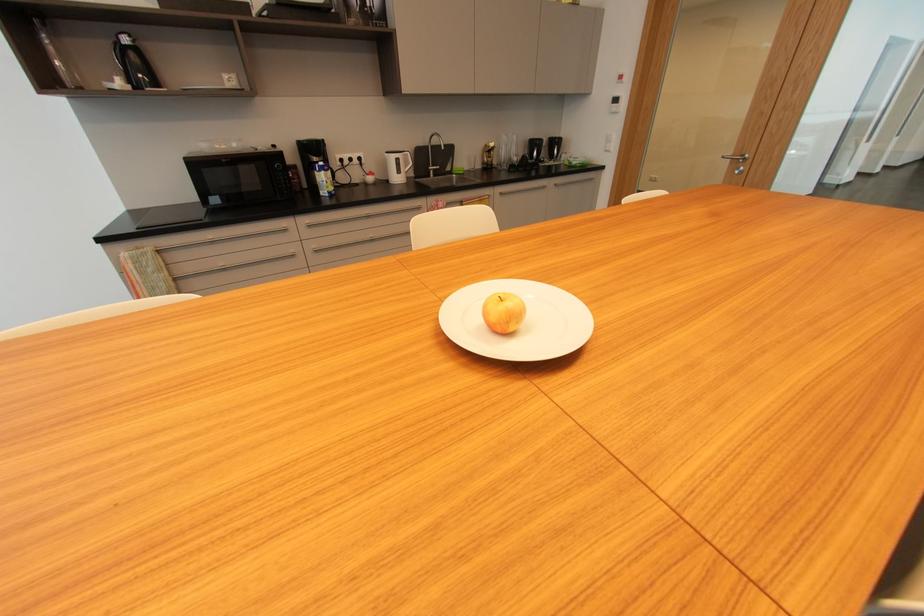
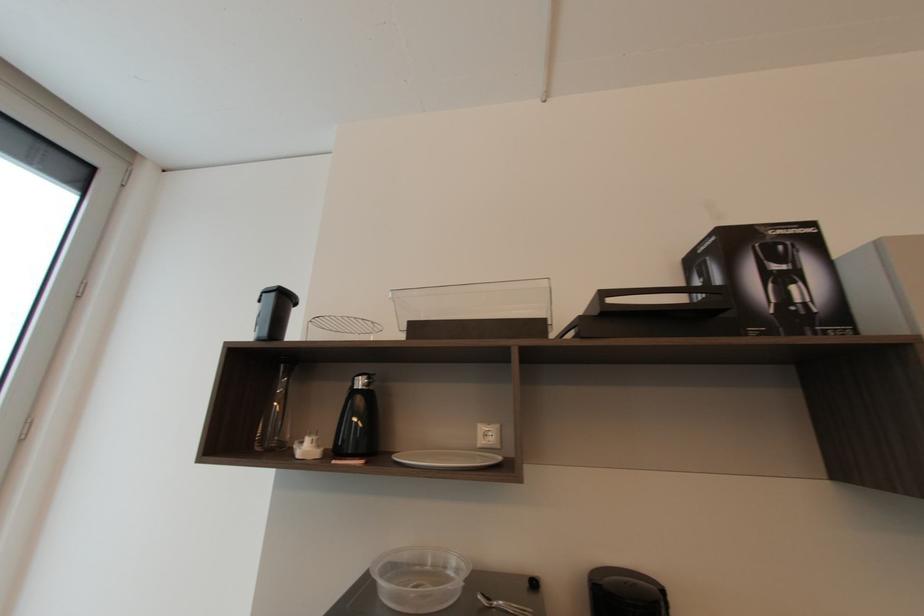
In the second image, find the point that corresponds to (x=128, y=41) in the first image.

(362, 384)